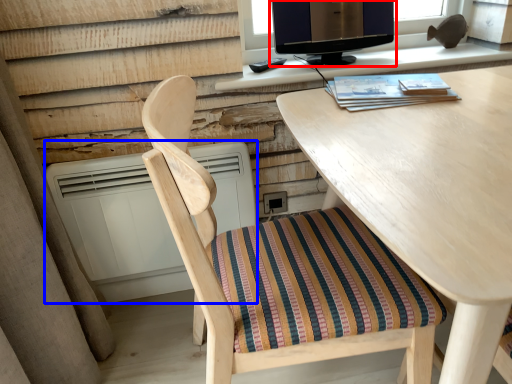
Question: Which point is closer to the camera, computer monitor (highlighted by a red box) or air conditioner (highlighted by a blue box)?

Choices:
 (A) computer monitor
 (B) air conditioner

Answer: (B)